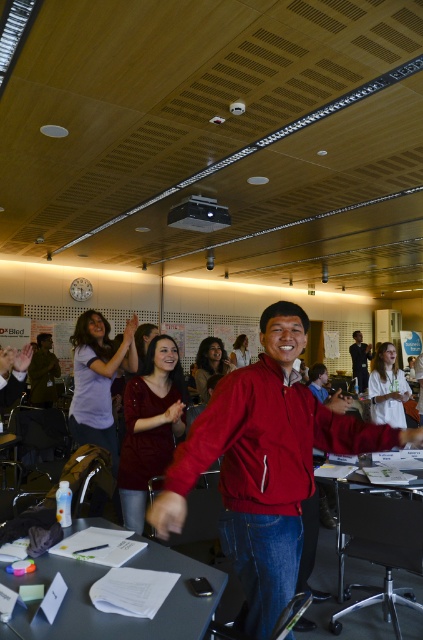
Who is more forward, (187, 614) or (43, 387)?

Positioned in front is point (187, 614).

Is white paper at center thinner than matte black jacket at center?

In fact, white paper at center might be wider than matte black jacket at center.

Is point (200, 564) closer to camera compared to point (41, 387)?

Yes, point (200, 564) is in front of point (41, 387).

Locate an element on the screen. white paper at center is located at coordinates (115, 612).

Is white paper at center taller than metallic gray table at center?

No.

Which is in front, point (181, 577) or point (415, 544)?

Positioned in front is point (181, 577).

This screenshot has width=423, height=640. What are the coordinates of `white paper at center` in the screenshot? It's located at (115, 612).

In the scene shown: Is the position of matte red jacket at center less distant than that of white paper at center?

No, it is behind white paper at center.

Does point (326, 445) lie in front of point (85, 621)?

No.

Which is in front, point (307, 451) or point (203, 566)?

Point (307, 451) is more forward.

The image size is (423, 640). I want to click on matte red jacket at center, so click(x=264, y=464).